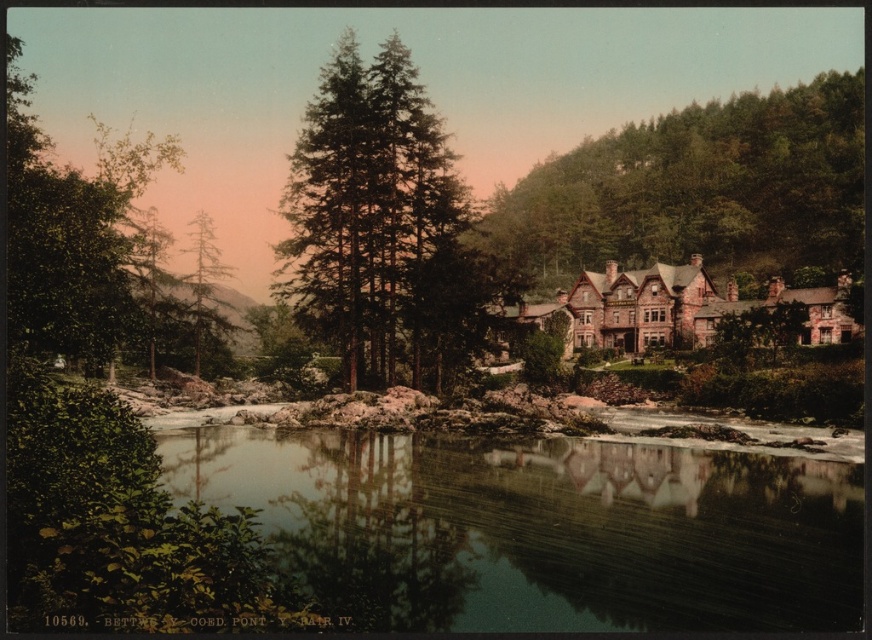
Does clear glass water at center have a smaller size compared to green textured tree at center?

Yes.

Which is behind, point (543, 516) or point (352, 125)?

The point (352, 125) is more distant.

Does point (723, 544) come closer to viewer compared to point (461, 180)?

Yes.

Where is `clear glass water at center`? clear glass water at center is located at coordinates (542, 529).

Which is in front, point (727, 112) or point (356, 289)?

Point (356, 289) is more forward.

How distant is green leafy tree at upper right from green textured tree at center?

green leafy tree at upper right and green textured tree at center are 55.06 meters apart.

This screenshot has height=640, width=872. In order to click on green leafy tree at upper right in this screenshot , I will do (x=699, y=189).

Is clear glass water at center bigger than green matte tree at upper left?

Incorrect, clear glass water at center is not larger than green matte tree at upper left.

Does point (632, 531) come in front of point (198, 211)?

That is True.

I want to click on clear glass water at center, so (x=542, y=529).